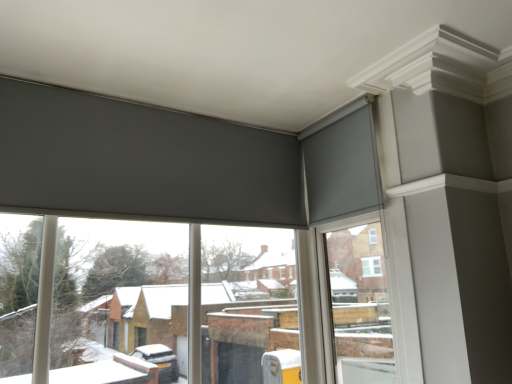
Question: In terms of width, does smooth white window frame at upper right look wider or thinner when compared to matte gray roller blinds at upper center?

Choices:
 (A) wide
 (B) thin

Answer: (B)

Question: In the image, is smooth white window frame at upper right positioned in front of or behind matte gray roller blinds at upper center?

Choices:
 (A) front
 (B) behind

Answer: (B)

Question: Which object is positioned farthest from the smooth white window frame at upper right?

Choices:
 (A) matte gray curtain at upper right
 (B) matte gray roller blinds at upper center

Answer: (B)

Question: Which is farther from the matte gray curtain at upper right?

Choices:
 (A) matte gray roller blinds at upper center
 (B) smooth white window frame at upper right

Answer: (A)